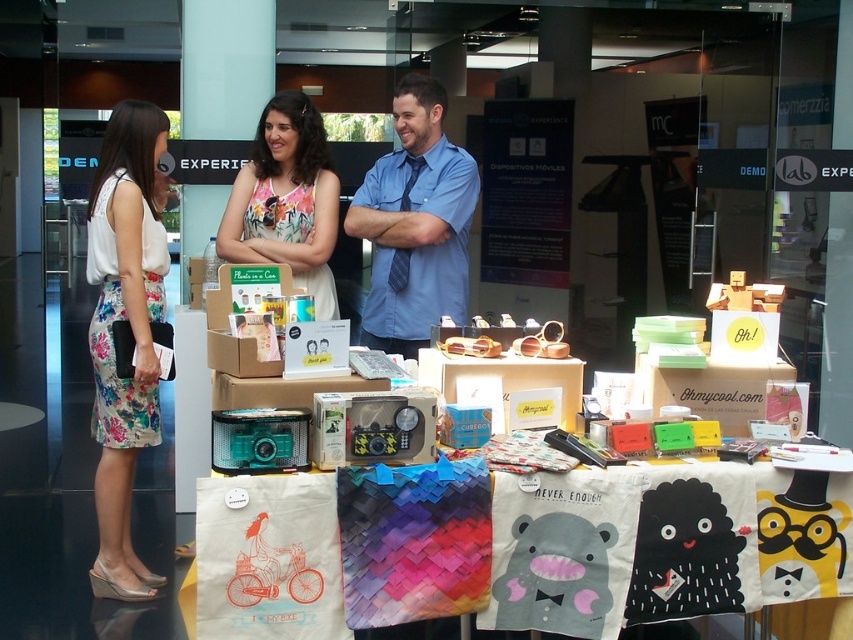
Is blue shirt at center behind matte cardboard box at lower right?

Yes.

Does blue shirt at center have a lesser height compared to matte cardboard box at lower right?

In fact, blue shirt at center may be taller than matte cardboard box at lower right.

This screenshot has width=853, height=640. What are the coordinates of `blue shirt at center` in the screenshot? It's located at (415, 224).

Is floral fabric skirt at left positioned at the back of matte cardboard box at lower right?

Yes, it is.

Can you confirm if floral fabric skirt at left is positioned to the left of matte cardboard box at lower right?

Yes, floral fabric skirt at left is to the left of matte cardboard box at lower right.

Identify the location of floral fabric skirt at left. (131, 330).

Which is behind, point (463, 534) or point (265, 237)?

The point (265, 237) is more distant.

Is canvas tote bags at center thinner than floral fabric dress at center?

No, canvas tote bags at center is not thinner than floral fabric dress at center.

Where is `canvas tote bags at center`? canvas tote bags at center is located at coordinates (515, 547).

In order to click on canvas tote bags at center in this screenshot , I will do `click(515, 547)`.